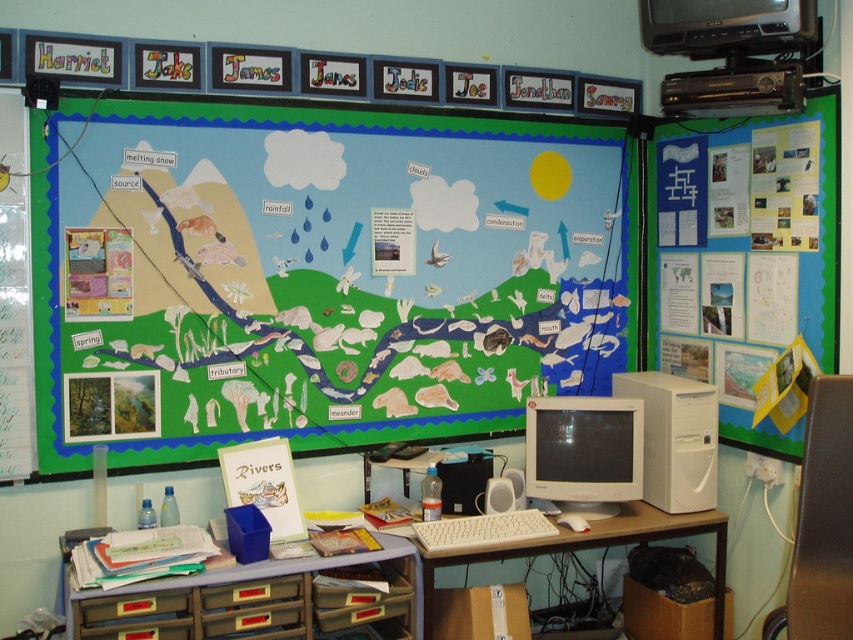
Question: Is matte black monitor at upper right above white plastic table at lower center?

Choices:
 (A) yes
 (B) no

Answer: (A)

Question: Based on their relative distances, which object is farther from the white plastic desktop computer at upper right?

Choices:
 (A) green paperboard at upper center
 (B) plastic drawer unit at lower center
 (C) matte white monitor at center
 (D) white plastic table at lower center

Answer: (B)

Question: Among these points, which one is farthest from the camera?

Choices:
 (A) (196, 608)
 (B) (502, 209)
 (C) (721, 12)

Answer: (B)

Question: Does matte white monitor at center lie behind matte black monitor at upper right?

Choices:
 (A) yes
 (B) no

Answer: (A)

Question: Can you confirm if white plastic desktop computer at upper right is bigger than matte black monitor at upper right?

Choices:
 (A) no
 (B) yes

Answer: (B)

Question: Among these objects, which one is farthest from the camera?

Choices:
 (A) matte white monitor at center
 (B) white plastic desktop computer at upper right
 (C) white plastic table at lower center

Answer: (A)